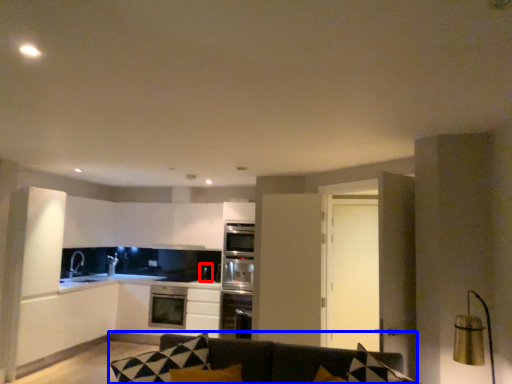
Question: Which object is further to the camera taking this photo, appliance (highlighted by a red box) or studio couch (highlighted by a blue box)?

Choices:
 (A) appliance
 (B) studio couch

Answer: (A)